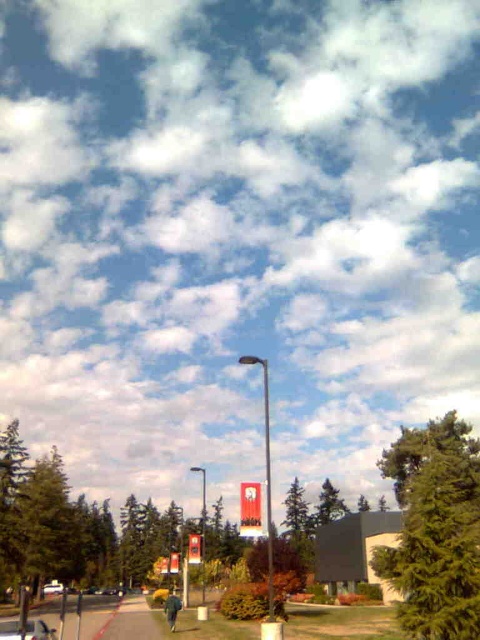
From the picture: Who is lower down, metallic silver car at lower left or white glossy car at center?

white glossy car at center

In the scene shown: Does metallic silver car at lower left appear over white glossy car at center?

Correct, metallic silver car at lower left is located above white glossy car at center.

Image resolution: width=480 pixels, height=640 pixels. I want to click on metallic silver car at lower left, so coord(25,630).

Is point (423, 604) positioned behind point (171, 593)?

No.

Is green textured tree at right below green fabric jacket at lower center?

No.

Is point (415, 497) in front of point (171, 616)?

Yes, point (415, 497) is in front of point (171, 616).

Locate an element on the screen. The height and width of the screenshot is (640, 480). green textured tree at right is located at coordinates (435, 529).

Who is positioned more to the right, metallic silver car at lower left or green fabric jacket at lower center?

green fabric jacket at lower center is more to the right.

Is point (25, 636) more distant than point (169, 609)?

No, (25, 636) is closer to viewer.

Find the location of a particular element. The image size is (480, 640). metallic silver car at lower left is located at coordinates (25, 630).